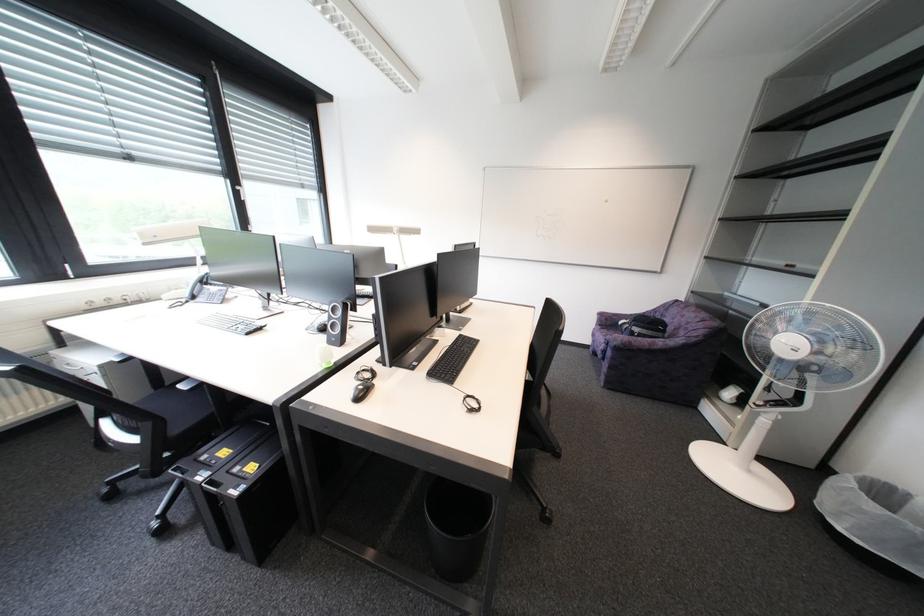
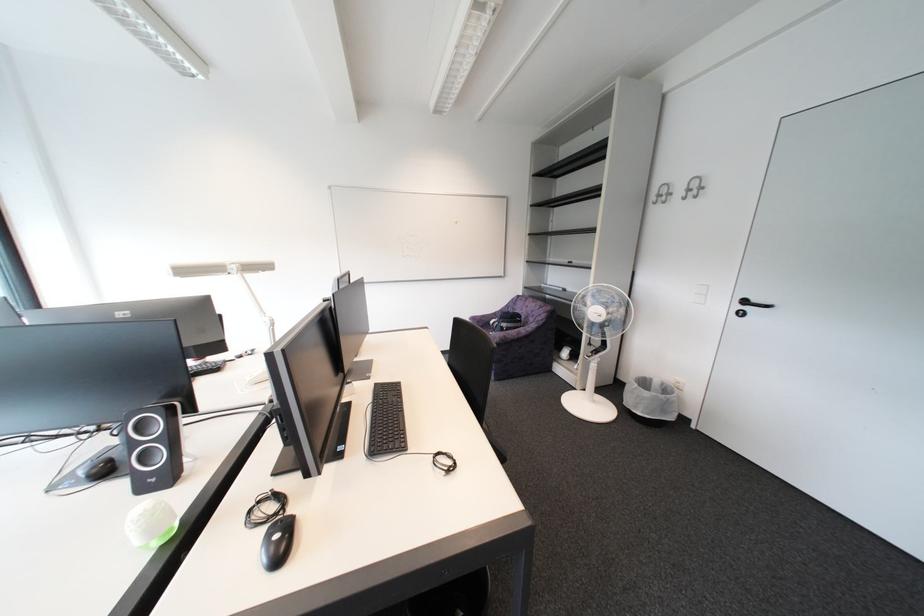
Question: The images are taken continuously from a first-person perspective. In which direction is your viewpoint rotating?

Choices:
 (A) Left
 (B) Right
 (C) Up
 (D) Down

Answer: (B)